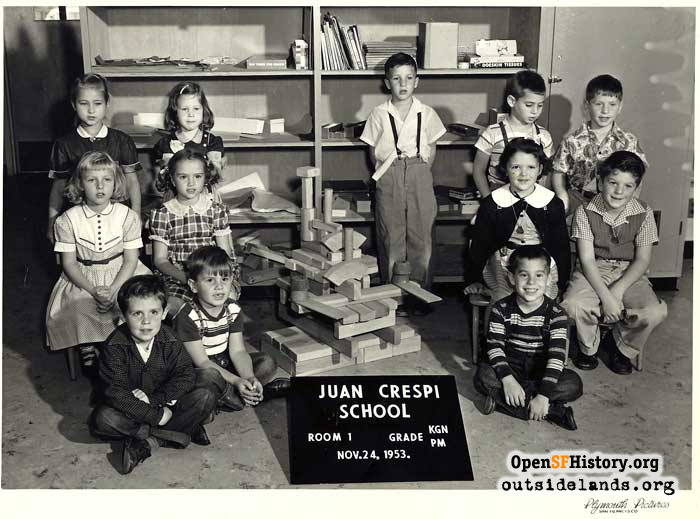
I want to click on door, so click(x=568, y=95).